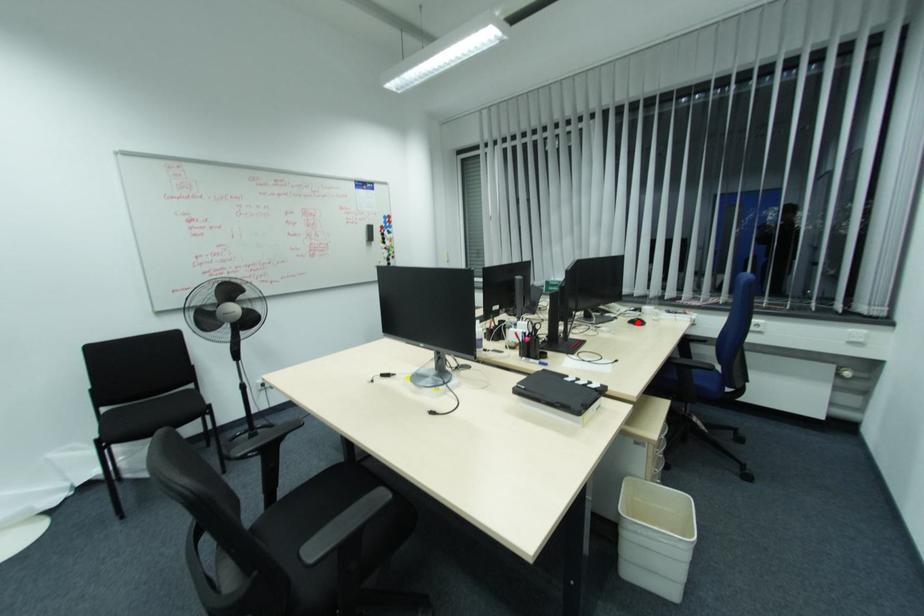
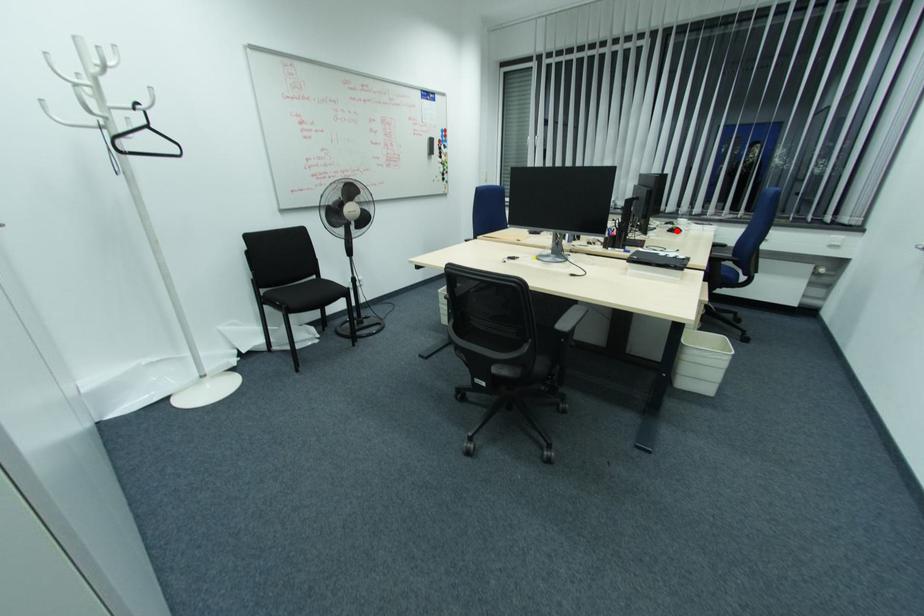
I am providing you with two images of the same scene from different viewpoints. A red point is marked on the first image and another point is marked on the second image. Are the points marked in image1 and image2 representing the same 3D position?

Yes